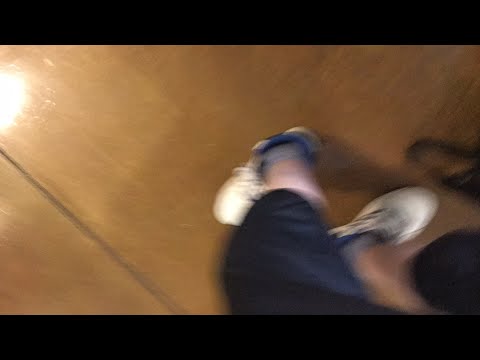
Where is `line separating tiles`? The height and width of the screenshot is (360, 480). line separating tiles is located at coordinates (63, 208).